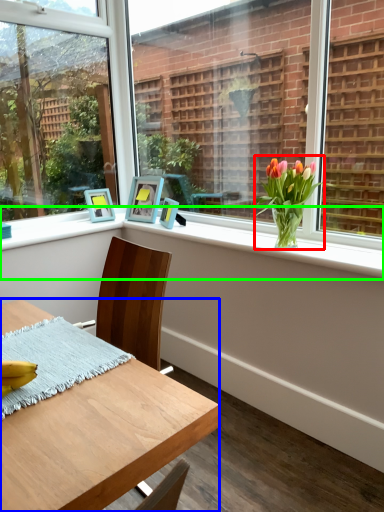
Question: Considering the real-world distances, which object is closest to houseplant (highlighted by a red box)? desk (highlighted by a blue box) or window sill (highlighted by a green box).

Choices:
 (A) desk
 (B) window sill

Answer: (B)